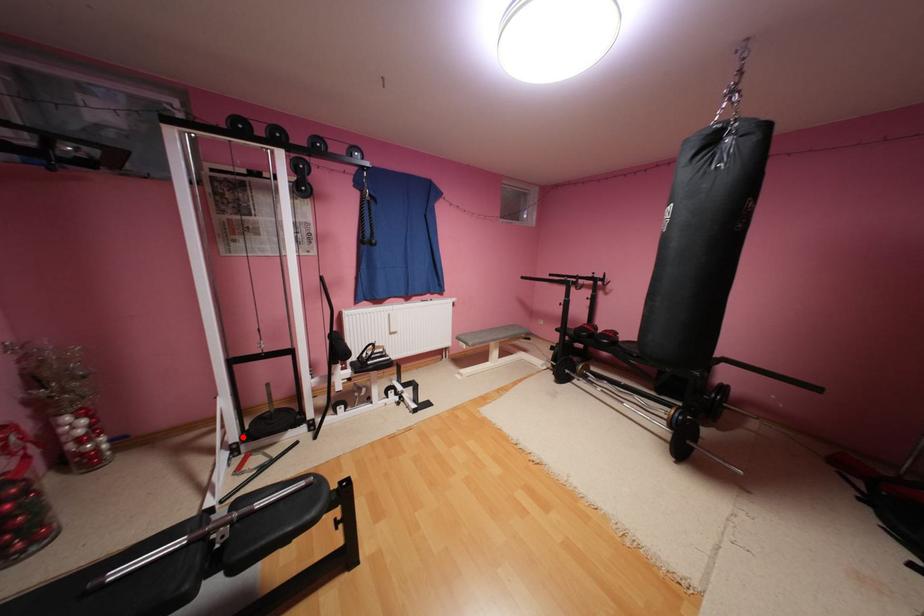
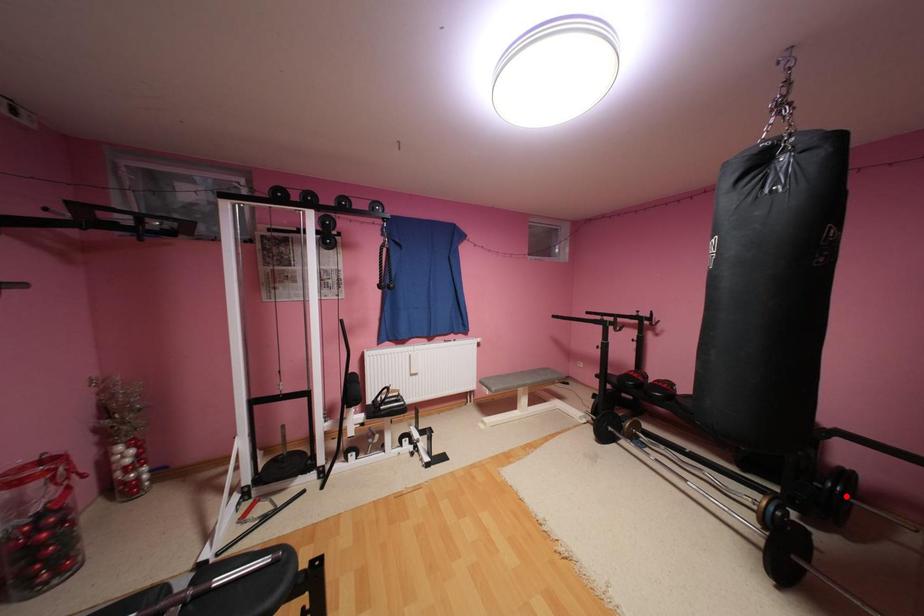
I am providing you with two images of the same scene from different viewpoints. A red point is marked on the first image and another point is marked on the second image. Are the points marked in image1 and image2 representing the same 3D position?

No